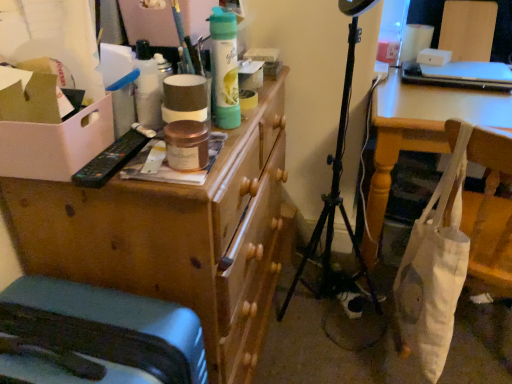
This screenshot has height=384, width=512. Find the location of `blank space situated above white cardboard box at left (from a real-world perspective)`. blank space situated above white cardboard box at left (from a real-world perspective) is located at coordinates (58, 105).